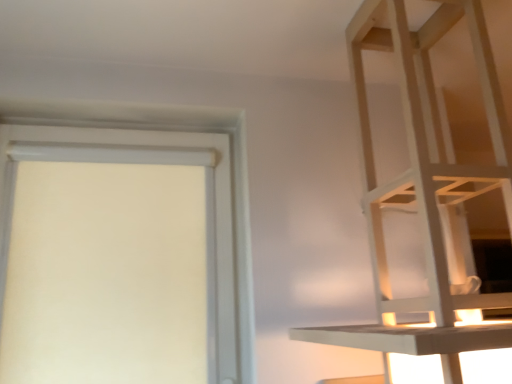
Find the location of `white wood shelf at upper right`. white wood shelf at upper right is located at coordinates (424, 189).

What do you see at coordinates (424, 189) in the screenshot? The height and width of the screenshot is (384, 512). I see `white wood shelf at upper right` at bounding box center [424, 189].

Identify the location of white matte door at left. (187, 131).

The height and width of the screenshot is (384, 512). What do you see at coordinates (187, 131) in the screenshot?
I see `white matte door at left` at bounding box center [187, 131].

This screenshot has height=384, width=512. Find the location of `white wood shelf at upper right`. white wood shelf at upper right is located at coordinates (424, 189).

Which object is positioned more to the right, white matte door at left or white wood shelf at upper right?

white wood shelf at upper right.

Is the depth of white matte door at left greater than that of white wood shelf at upper right?

Yes, it is behind white wood shelf at upper right.

Does point (248, 274) come in front of point (473, 301)?

No.

From the picture: From the image's perspective, which is below, white matte door at left or white wood shelf at upper right?

white matte door at left appears lower in the image.

From a real-world perspective, is white matte door at left on white wood shelf at upper right?

Incorrect, from a real-world perspective, white matte door at left is lower than white wood shelf at upper right.

Between white matte door at left and white wood shelf at upper right, which one has smaller width?

white matte door at left.

From their relative heights in the image, would you say white matte door at left is taller or shorter than white wood shelf at upper right?

Considering their sizes, white matte door at left has less height than white wood shelf at upper right.

Is white matte door at left bigger or smaller than white wood shelf at upper right?

Considering their sizes, white matte door at left takes up less space than white wood shelf at upper right.

Looking at this image, is white matte door at left located outside white wood shelf at upper right?

Yes, white matte door at left is not within white wood shelf at upper right.

Are white matte door at left and white wood shelf at upper right making contact?

white matte door at left and white wood shelf at upper right are not in contact.

Could you tell me if white matte door at left is facing white wood shelf at upper right?

No, white matte door at left does not turn towards white wood shelf at upper right.

What's the angular difference between white matte door at left and white wood shelf at upper right's facing directions?

They differ by 0.4 degrees in their facing directions.

Looking at this image, how distant is white matte door at left from white wood shelf at upper right?

white matte door at left is 23.24 inches away from white wood shelf at upper right.

Identify the location of furniture on the right side of white matte door at left. (424, 189).

Considering the positions of objects white wood shelf at upper right and white matte door at left in the image provided, who is more to the left, white wood shelf at upper right or white matte door at left?

Positioned to the left is white matte door at left.

Is white wood shelf at upper right further to the viewer compared to white matte door at left?

No.

Is point (480, 311) in front of point (240, 354)?

Yes, it is in front of point (240, 354).

From the image's perspective, is white wood shelf at upper right positioned above or below white matte door at left?

Based on their image positions, white wood shelf at upper right is located above white matte door at left.

From a real-world perspective, which object stands above the other?

white wood shelf at upper right, from a real-world perspective.

In terms of width, does white wood shelf at upper right look wider or thinner when compared to white matte door at left?

white wood shelf at upper right is wider than white matte door at left.

Between white wood shelf at upper right and white matte door at left, which one has less height?

white matte door at left.

Does white wood shelf at upper right have a larger size compared to white matte door at left?

Yes, white wood shelf at upper right is bigger than white matte door at left.

Is white matte door at left a part of white wood shelf at upper right?

No, white matte door at left is not inside white wood shelf at upper right.

Is white wood shelf at upper right not close to white matte door at left?

white wood shelf at upper right is near white matte door at left, not far away.

Is white wood shelf at upper right oriented away from white matte door at left?

No, white wood shelf at upper right is not facing the opposite direction of white matte door at left.

What's the angular difference between white wood shelf at upper right and white matte door at left's facing directions?

0.4 degrees separate the facing orientations of white wood shelf at upper right and white matte door at left.

Measure the distance from white wood shelf at upper right to white matte door at left.

23.24 inches.

The image size is (512, 384). Find the location of `furniture above the white matte door at left (from a real-world perspective)`. furniture above the white matte door at left (from a real-world perspective) is located at coordinates (424, 189).

At what (x,y) coordinates should I click in order to perform the action: click on furniture that appears on the right of white matte door at left. Please return your answer as a coordinate pair (x, y). The width and height of the screenshot is (512, 384). Looking at the image, I should click on (424, 189).

Find the location of a particular element. This screenshot has height=384, width=512. furniture above the white matte door at left (from a real-world perspective) is located at coordinates (424, 189).